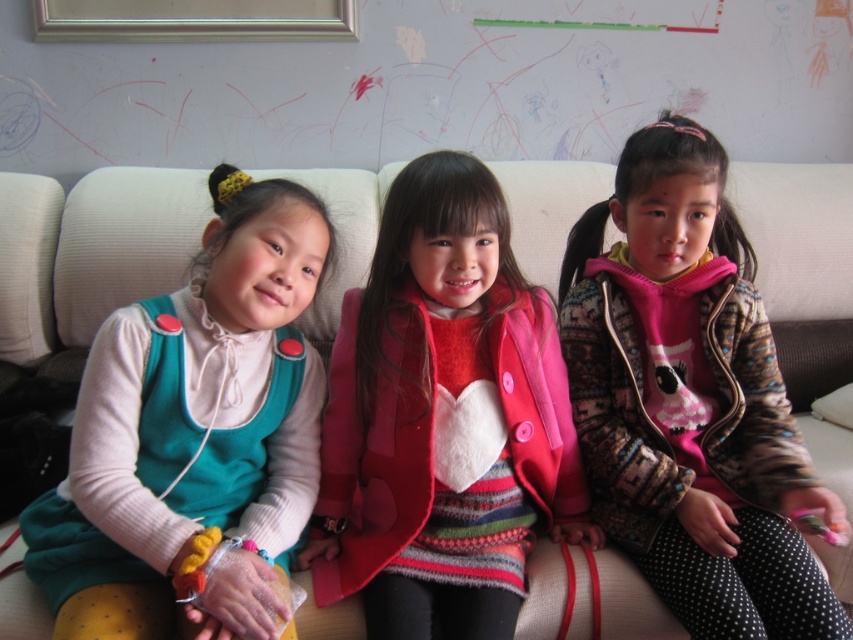
Question: Which of the following is the farthest from the observer?

Choices:
 (A) pink fuzzy sweater at center
 (B) teal jersey at left
 (C) matte pink coat at center

Answer: (A)

Question: Among these points, which one is farthest from the camera?

Choices:
 (A) (106, 586)
 (B) (491, 556)
 (C) (674, 440)

Answer: (C)

Question: Which object appears closest to the camera in this image?

Choices:
 (A) matte pink coat at center
 (B) teal jersey at left
 (C) pink fuzzy sweater at center

Answer: (B)

Question: Is pink fuzzy sweater at center smaller than teal jersey at left?

Choices:
 (A) yes
 (B) no

Answer: (B)

Question: Is pink fuzzy sweater at center to the left of teal jersey at left from the viewer's perspective?

Choices:
 (A) yes
 (B) no

Answer: (B)

Question: Is matte pink coat at center wider than teal jersey at left?

Choices:
 (A) no
 (B) yes

Answer: (B)